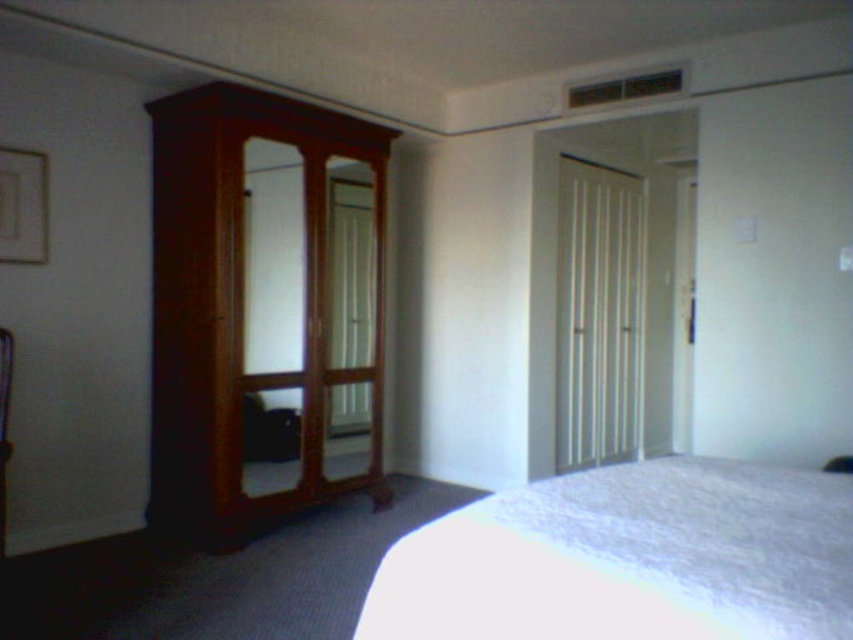
Which is behind, point (157, 264) or point (372, 422)?

Point (372, 422)

Is point (242, 225) positioned in front of point (326, 349)?

Yes, point (242, 225) is in front of point (326, 349).

Which is behind, point (254, 193) or point (344, 380)?

The point (344, 380) is behind.

This screenshot has height=640, width=853. I want to click on mahogany wood dresser at left, so click(263, 310).

This screenshot has height=640, width=853. What do you see at coordinates (263, 310) in the screenshot?
I see `mahogany wood dresser at left` at bounding box center [263, 310].

Is mahogany wood dresser at left above white fluffy bed at lower right?

Yes, mahogany wood dresser at left is above white fluffy bed at lower right.

Locate an element on the screen. The width and height of the screenshot is (853, 640). mahogany wood dresser at left is located at coordinates (263, 310).

The width and height of the screenshot is (853, 640). Describe the element at coordinates (630, 557) in the screenshot. I see `white fluffy bed at lower right` at that location.

Between white fluffy bed at lower right and wooden mirror at left, which one is positioned higher?

Positioned higher is wooden mirror at left.

The image size is (853, 640). Identify the location of white fluffy bed at lower right. (630, 557).

Where is `white fluffy bed at lower right`? This screenshot has height=640, width=853. white fluffy bed at lower right is located at coordinates (630, 557).